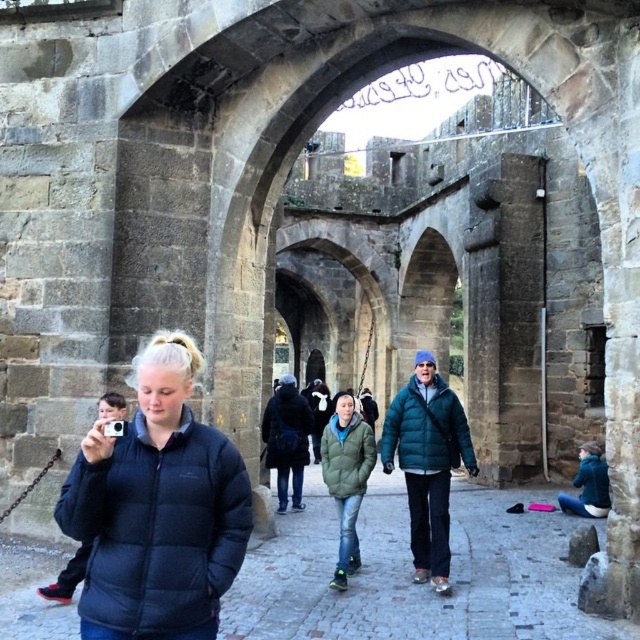
Does matte black jacket at left appear over teal puffer jacket at center?

Indeed, matte black jacket at left is positioned over teal puffer jacket at center.

I want to click on matte black jacket at left, so click(x=157, y=509).

Can you confirm if matte black jacket at left is positioned below green matte jacket at center?

Actually, matte black jacket at left is above green matte jacket at center.

You are a GUI agent. You are given a task and a screenshot of the screen. Output one action in this format:
    pyautogui.click(x=<x>, y=<y>)
    Task: Click on the matte black jacket at left
    The image size is (640, 640).
    Given the screenshot: What is the action you would take?
    pyautogui.click(x=157, y=509)

Who is more forward, (433,451) or (356,484)?

Point (433,451) is in front.

Is teal puffer jacket at center smaller than green matte jacket at center?

No.

Does point (445, 589) come closer to viewer compared to point (348, 572)?

That is True.

This screenshot has height=640, width=640. Find the location of `teal puffer jacket at center`. teal puffer jacket at center is located at coordinates (428, 461).